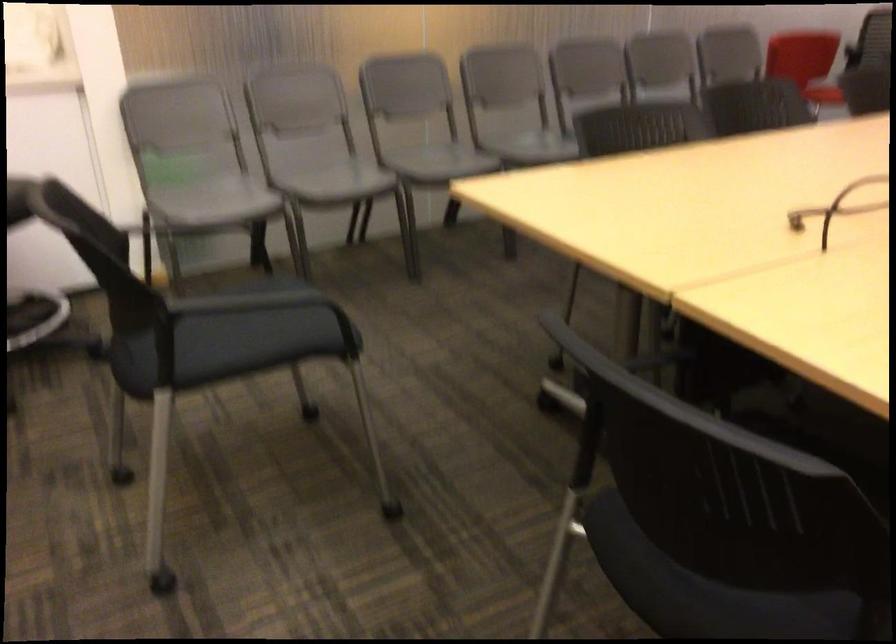
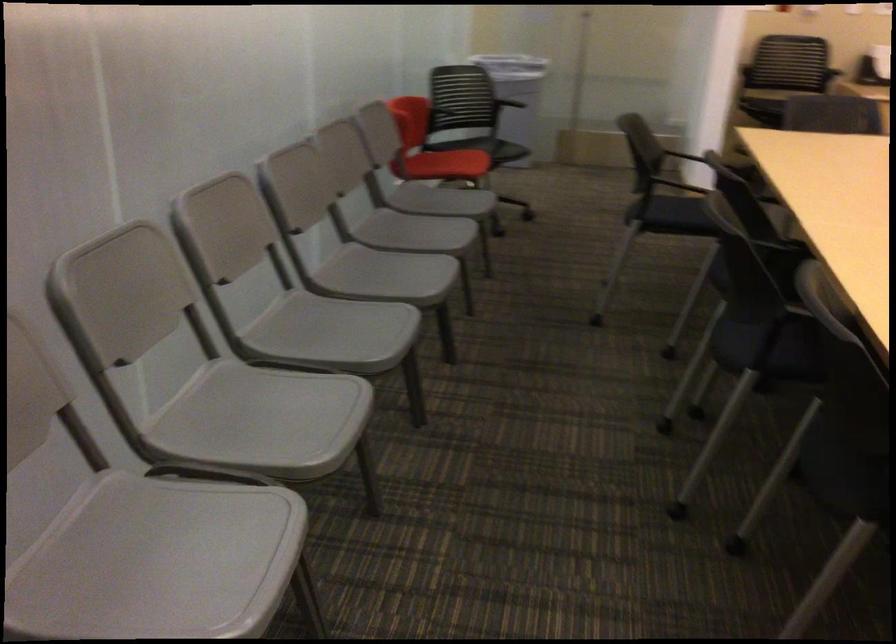
The point at (342, 173) is marked in the first image. Where is the corresponding point in the second image?

(158, 561)